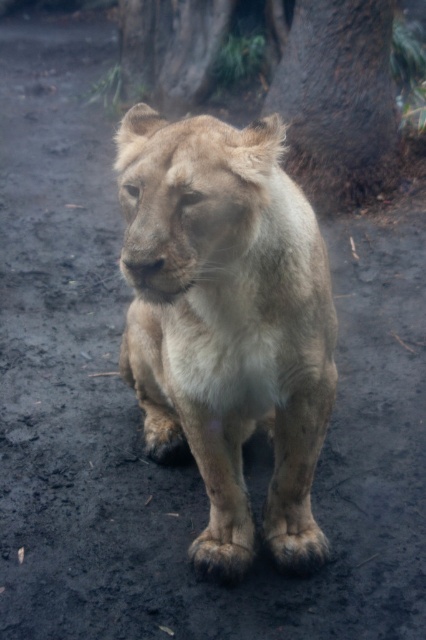
Question: Which object is farther from the camera taking this photo?

Choices:
 (A) fuzzy beige lion at center
 (B) brown rough bark at upper center

Answer: (B)

Question: Is fuzzy beige lion at center below brown rough bark at upper center?

Choices:
 (A) no
 (B) yes

Answer: (B)

Question: Can you confirm if fuzzy beige lion at center is bigger than brown rough bark at upper center?

Choices:
 (A) no
 (B) yes

Answer: (B)

Question: Is fuzzy beige lion at center bigger than brown rough bark at upper center?

Choices:
 (A) no
 (B) yes

Answer: (B)